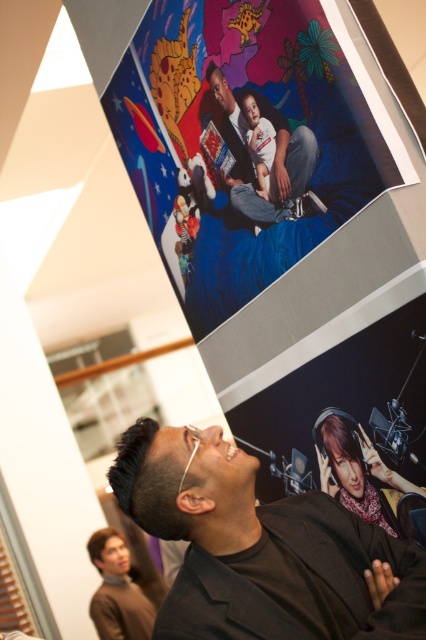
Question: Is vibrant paper poster at upper center below black matte suit at lower center?

Choices:
 (A) no
 (B) yes

Answer: (A)

Question: Is vibrant paper poster at upper center to the right of brown matte hair at upper center from the viewer's perspective?

Choices:
 (A) no
 (B) yes

Answer: (A)

Question: Which is farther from the black matte suit at lower center?

Choices:
 (A) matte blue jeans at upper center
 (B) dark brown hair at lower left

Answer: (B)

Question: Which point is closer to the camera?

Choices:
 (A) vibrant paper poster at upper center
 (B) dark brown hair at lower left
 (C) dark brown hair at upper center

Answer: (C)

Question: Is vibrant paper poster at upper center to the left of dark brown hair at upper center from the viewer's perspective?

Choices:
 (A) no
 (B) yes

Answer: (A)

Question: Which of the following is the farthest from the observer?

Choices:
 (A) (317, 605)
 (B) (149, 458)

Answer: (B)